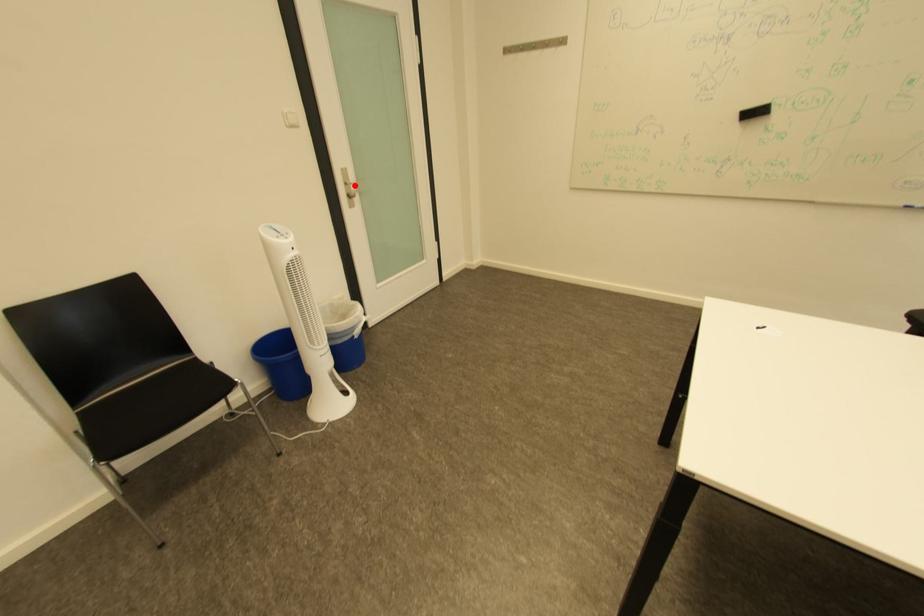
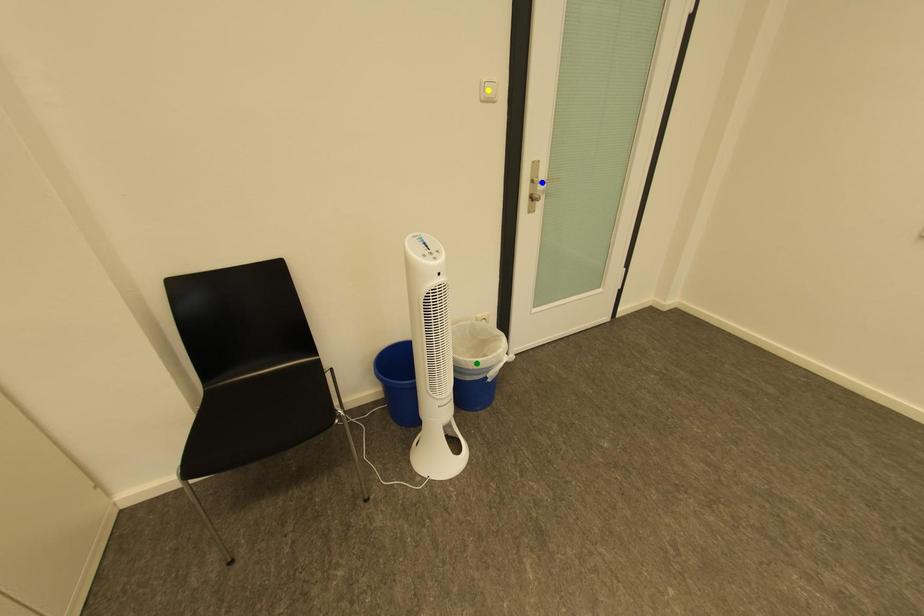
Question: I am providing you with two images of the same scene from different viewpoints. A red point is marked on the first image. You are given multiple points on the second image. Which mark in image 2 goes with the point in image 1?

Choices:
 (A) yellow point
 (B) green point
 (C) blue point

Answer: (C)